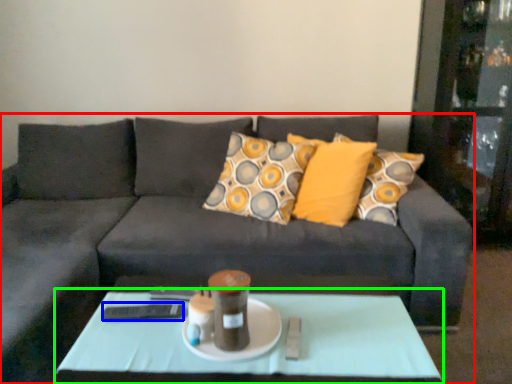
Question: Based on their relative distances, which object is farther from studio couch (highlighted by a red box)? Choose from remote (highlighted by a blue box) and coffee table (highlighted by a green box).

Choices:
 (A) remote
 (B) coffee table

Answer: (A)